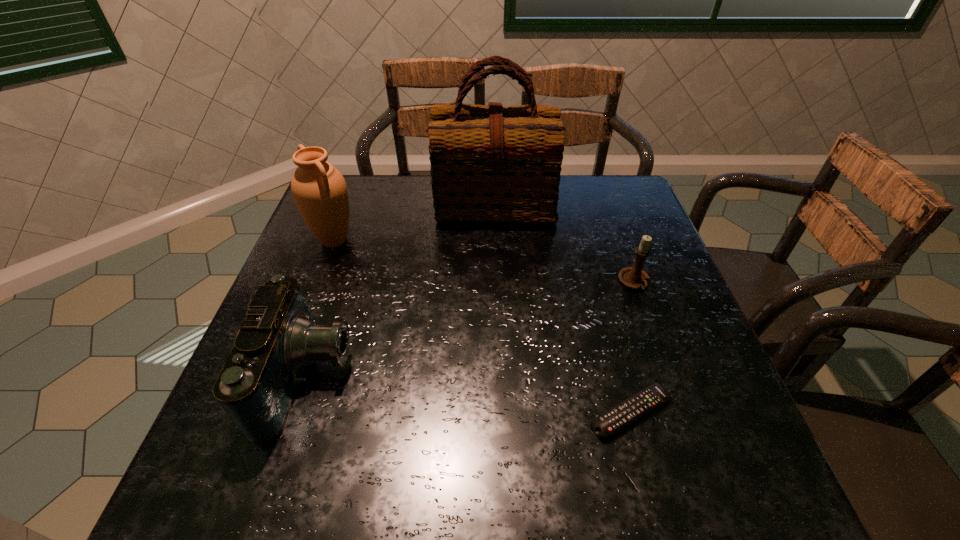
The height and width of the screenshot is (540, 960). Find the location of `free space at the far right corner of the desktop`. free space at the far right corner of the desktop is located at coordinates (585, 178).

You are a GUI agent. You are given a task and a screenshot of the screen. Output one action in this format:
    pyautogui.click(x=<x>, y=<y>)
    Task: Click on the vacant space in between the shortest object and the shopping bag
    The image size is (960, 540).
    Given the screenshot: What is the action you would take?
    pyautogui.click(x=563, y=309)

The height and width of the screenshot is (540, 960). I want to click on free space that is in between the urn and the second shortest object, so click(x=484, y=262).

Locate an element on the screen. This screenshot has height=540, width=960. free spot between the third tallest object and the urn is located at coordinates (322, 309).

I want to click on free space between the remote control and the candle holder, so click(x=633, y=348).

Locate an element on the screen. Image resolution: width=960 pixels, height=540 pixels. unoccupied area between the tallest object and the third tallest object is located at coordinates click(x=401, y=291).

Where is `vacant space that's between the second tallest object and the candle holder`? The image size is (960, 540). vacant space that's between the second tallest object and the candle holder is located at coordinates (484, 262).

Identify the location of vacant space in between the urn and the shortest object. (483, 327).

Where is `free space that is in between the third nearest object and the remote control`? This screenshot has height=540, width=960. free space that is in between the third nearest object and the remote control is located at coordinates tap(633, 348).

Where is `vacant space that is in between the shopping bag and the third nearest object`? Image resolution: width=960 pixels, height=540 pixels. vacant space that is in between the shopping bag and the third nearest object is located at coordinates (564, 245).